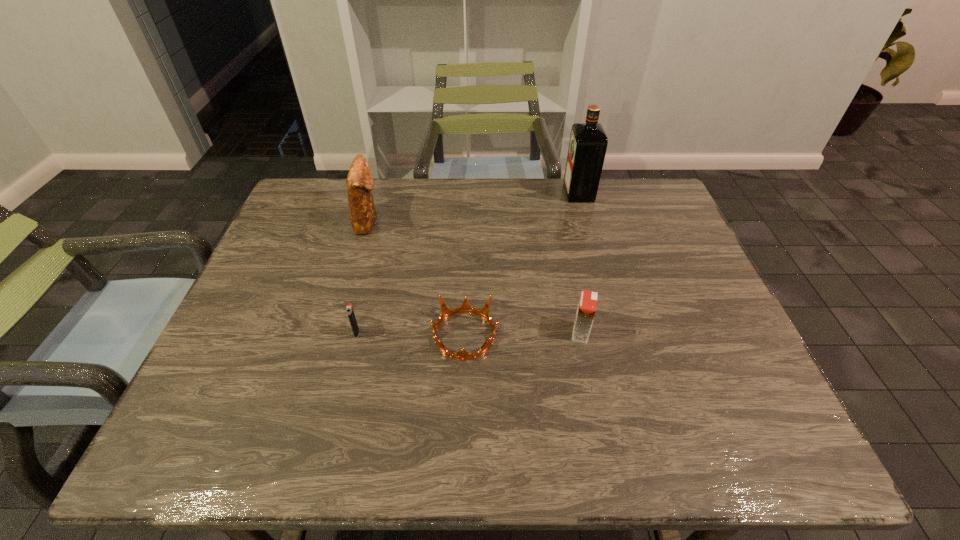
This screenshot has height=540, width=960. I want to click on free spot located on the front label of the liquor, so click(x=522, y=193).

Identify the location of vacant space located on the front label of the liquor. (479, 193).

At what (x,y) coordinates should I click in order to perform the action: click on vacant space located on the front label of the liquor. Please return your answer as a coordinate pair (x, y). This screenshot has height=540, width=960. Looking at the image, I should click on (507, 193).

Locate an element on the screen. vacant space situated on the open side of the clutch bag is located at coordinates (427, 220).

Find the location of a particular element. The height and width of the screenshot is (540, 960). vacant space situated on the left of the orange juice is located at coordinates (540, 333).

At what (x,y) coordinates should I click in order to perform the action: click on free space located on the right of the second object from left to right. Please return your answer as a coordinate pair (x, y). The width and height of the screenshot is (960, 540). Looking at the image, I should click on (517, 332).

The height and width of the screenshot is (540, 960). I want to click on free space located 0.230m on the right of the third object from left to right, so pyautogui.click(x=597, y=335).

Locate an element on the screen. The image size is (960, 540). liquor that is positioned at the far edge is located at coordinates (588, 143).

I want to click on clutch bag that is at the far edge, so pyautogui.click(x=359, y=181).

This screenshot has height=540, width=960. Identify the location of vacant space at the far edge. (464, 182).